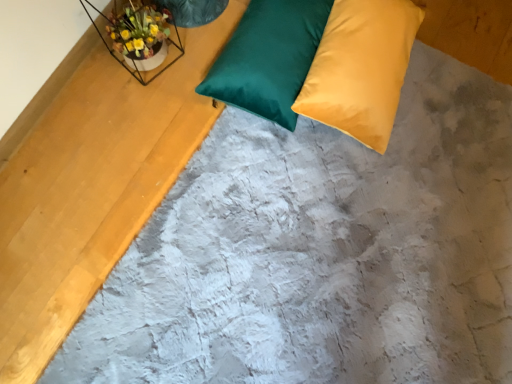
Question: From the image's perspective, is matte yellow pillow at upper right, the second pillow positioned from the left, positioned above or below satin green pillow at upper center, positioned as the 2th pillow in right-to-left order?

Choices:
 (A) above
 (B) below

Answer: (B)

Question: Which is correct: matte yellow pillow at upper right, the second pillow positioned from the left, is inside satin green pillow at upper center, arranged as the 1th pillow when viewed from the left, or outside of it?

Choices:
 (A) outside
 (B) inside

Answer: (A)

Question: Estimate the real-world distances between objects in this image. Which object is closer to the metallic wire frame at upper left?

Choices:
 (A) satin green pillow at upper center, positioned as the 2th pillow in right-to-left order
 (B) matte yellow pillow at upper right, the second pillow positioned from the left

Answer: (A)

Question: Based on their relative distances, which object is nearer to the matte yellow pillow at upper right, the 1th pillow in the right-to-left sequence?

Choices:
 (A) satin green pillow at upper center, arranged as the 1th pillow when viewed from the left
 (B) metallic wire frame at upper left

Answer: (A)